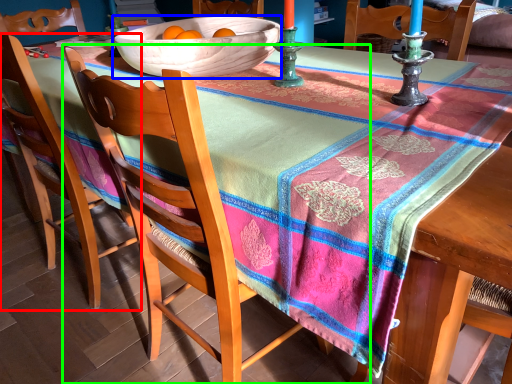
Question: Which object is positioned closest to chair (highlighted by a red box)? Select from bowl (highlighted by a blue box) and chair (highlighted by a green box).

Choices:
 (A) bowl
 (B) chair

Answer: (B)